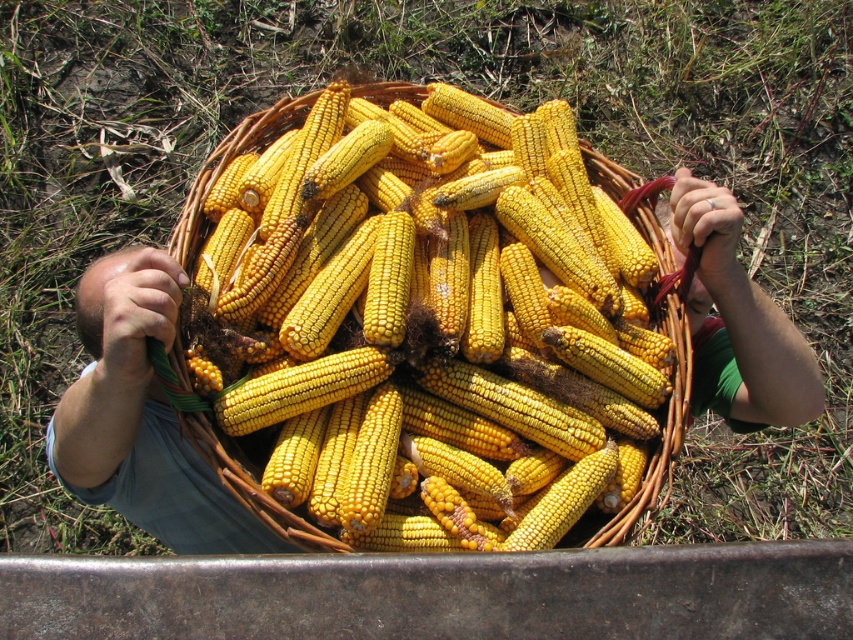
Question: Is woven brown basket at center further to the viewer compared to green fabric hand at upper center?

Choices:
 (A) yes
 (B) no

Answer: (B)

Question: Does woven brown basket at center lie in front of green fabric hand at upper center?

Choices:
 (A) no
 (B) yes

Answer: (B)

Question: Which point appears farthest from the camera in this image?

Choices:
 (A) (457, 364)
 (B) (781, 419)

Answer: (B)

Question: Which object appears closest to the camera in this image?

Choices:
 (A) green fabric hand at upper center
 (B) woven brown basket at center

Answer: (B)

Question: Which point is closer to the camera?

Choices:
 (A) woven brown basket at center
 (B) green fabric hand at upper center

Answer: (A)

Question: Is woven brown basket at center behind green fabric hand at upper center?

Choices:
 (A) yes
 (B) no

Answer: (B)